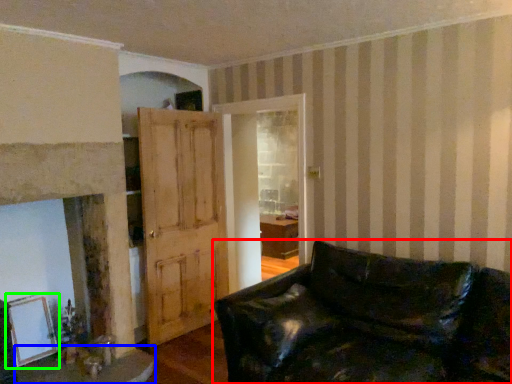
Question: Estimate the real-world distances between objects in this image. Which object is closer to studio couch (highlighted by a red box), table (highlighted by a blue box) or picture frame (highlighted by a green box)?

Choices:
 (A) table
 (B) picture frame

Answer: (A)